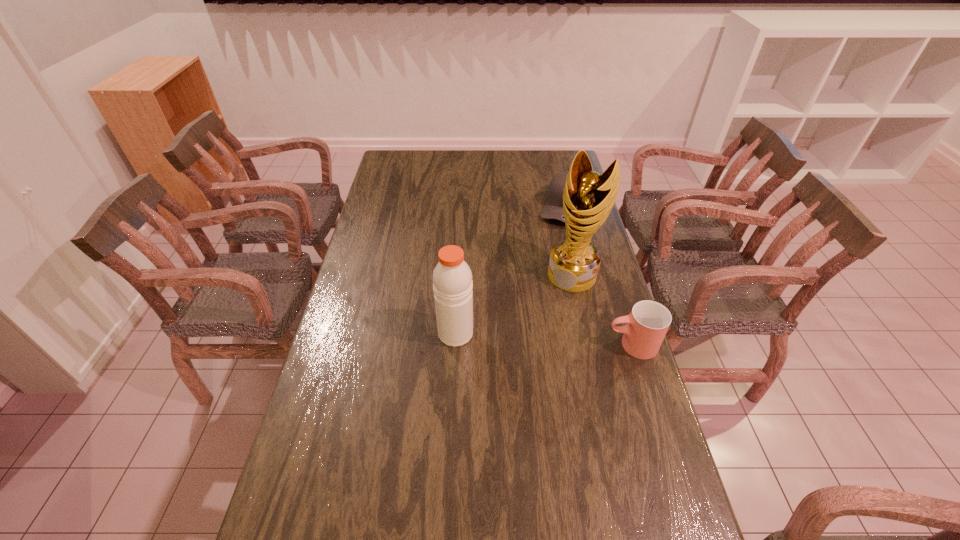
At what (x,y) coordinates should I click in order to perform the action: click on free spot on the desktop that is between the shaker and the cup and is positioned on the front-facing side of the tallest object. Please return your answer as a coordinate pair (x, y). Looking at the image, I should click on (529, 338).

Where is `vacant spot on the desktop that is between the shaker and the cup and is positioned on the front brim of the farthest object`? This screenshot has width=960, height=540. vacant spot on the desktop that is between the shaker and the cup and is positioned on the front brim of the farthest object is located at coordinates (519, 338).